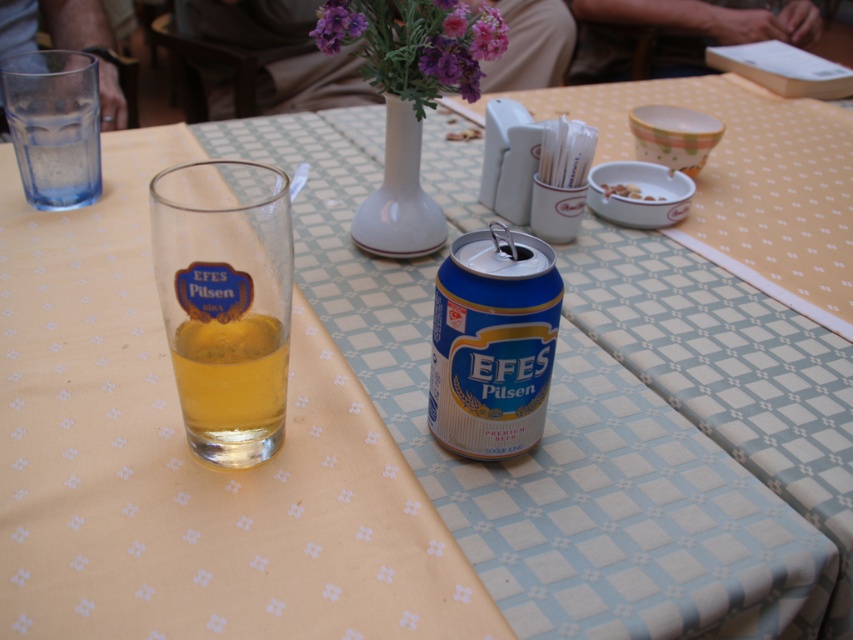
You are a server at the outdoor cafe and need to place a new menu between the blue metallic can at center and the white glossy vase at center. The menu is 20 centimeters wide. Can you fit it between them without moving either object?

The blue metallic can at center and white glossy vase at center are 18.69 centimeters apart. Since the menu is 20 centimeters wide, which is wider than the space between them, it cannot be placed there without moving either object.

You are a customer at the outdoor cafe and want to choose the beverage with the wider opening to drink your beer. Which one should you pick between the translucent glass at left and the transparent glass at upper left?

The translucent glass at left is wider than the transparent glass at upper left, so you should pick the translucent glass at left to drink your beer.